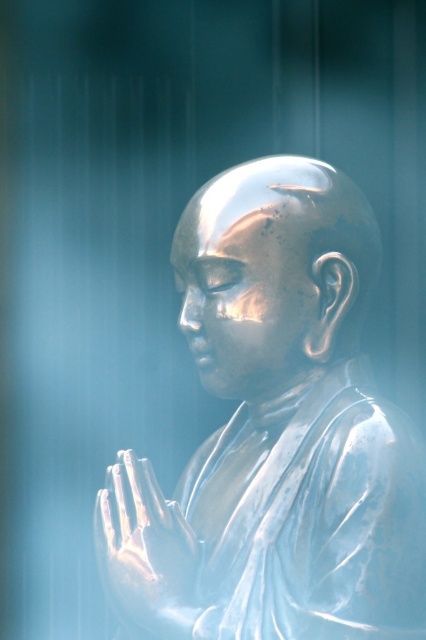
Question: Estimate the real-world distances between objects in this image. Which object is closer to the shiny silver monk at center?

Choices:
 (A) shiny metallic head at center
 (B) satin gold hands at center

Answer: (B)

Question: Does shiny metallic head at center appear on the left side of satin gold hands at center?

Choices:
 (A) no
 (B) yes

Answer: (A)

Question: Which point is closer to the camera?

Choices:
 (A) satin gold hands at center
 (B) shiny silver monk at center
 (C) shiny metallic head at center

Answer: (B)

Question: Is shiny silver monk at center to the right of satin gold hands at center from the viewer's perspective?

Choices:
 (A) yes
 (B) no

Answer: (A)

Question: Which object is farther from the camera taking this photo?

Choices:
 (A) shiny silver monk at center
 (B) shiny metallic head at center
 (C) satin gold hands at center

Answer: (B)

Question: Observing the image, what is the correct spatial positioning of shiny metallic head at center in reference to satin gold hands at center?

Choices:
 (A) left
 (B) right

Answer: (B)